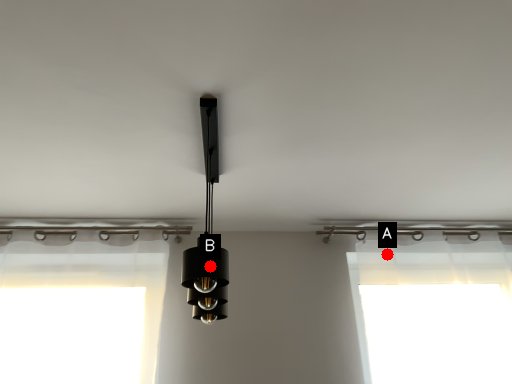
Question: Two points are circled on the image, labeled by A and B beside each circle. Which of the following is the closest to the observer?

Choices:
 (A) A is closer
 (B) B is closer

Answer: (B)